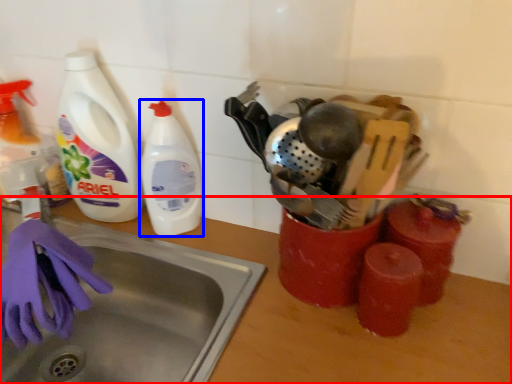
Question: Which of the following is the closest to the observer, counter top (highlighted by a red box) or cleaning product (highlighted by a blue box)?

Choices:
 (A) counter top
 (B) cleaning product

Answer: (A)